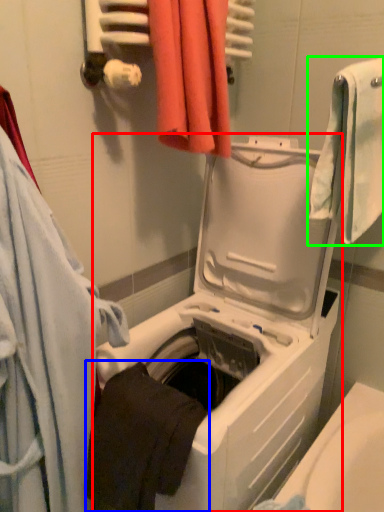
Question: Based on their relative distances, which object is farther from washing machine (highlighted by a red box)? Choose from towel (highlighted by a blue box) and towel (highlighted by a green box).

Choices:
 (A) towel
 (B) towel

Answer: (B)